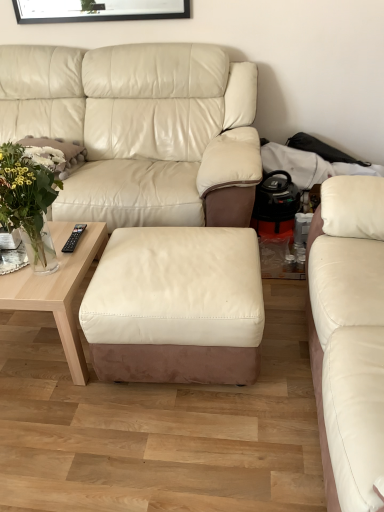
The image size is (384, 512). Identify the location of vacant space underneath black matte picture frame at upper center (from a real-world perspective). (134, 35).